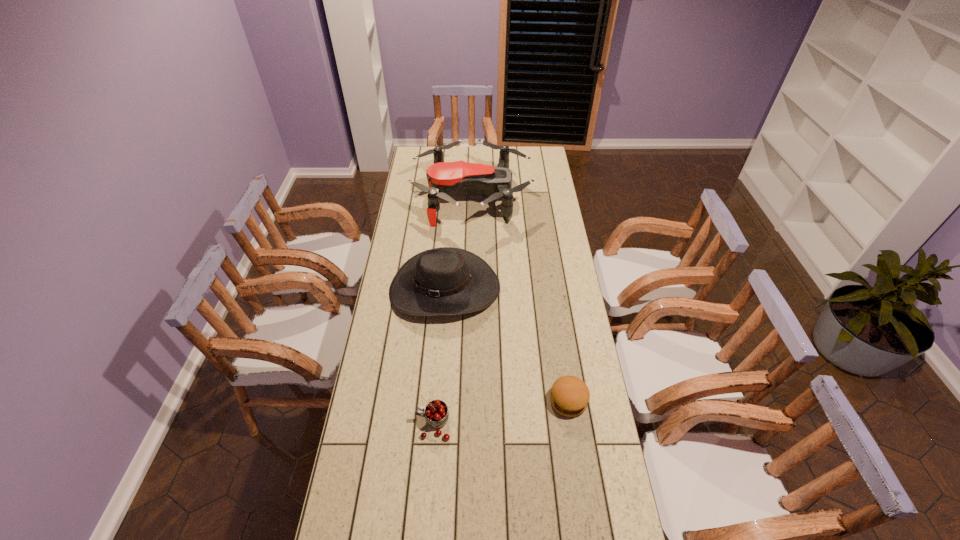
I want to click on object located in the far edge section of the desktop, so click(x=445, y=180).

You are a GUI agent. You are given a task and a screenshot of the screen. Output one action in this format:
    pyautogui.click(x=<x>, y=<y>)
    Task: Click on the drone positioned at the left edge
    The width and height of the screenshot is (960, 540).
    Given the screenshot: What is the action you would take?
    tap(445, 180)

This screenshot has width=960, height=540. What are the coordinates of `cowboy hat that is at the left edge` in the screenshot? It's located at (445, 281).

Identify the location of drone present at the right edge. Image resolution: width=960 pixels, height=540 pixels. (445, 180).

Identify the location of hamburger that is at the right edge. This screenshot has height=540, width=960. pos(569,396).

Find the location of a particular element. object present at the far left corner is located at coordinates (445, 180).

Locate an element on the screen. The height and width of the screenshot is (540, 960). object that is at the far right corner is located at coordinates (445, 180).

The image size is (960, 540). I want to click on free space at the far edge of the desktop, so click(457, 153).

Where is `vacant space at the left edge of the desktop`? This screenshot has width=960, height=540. vacant space at the left edge of the desktop is located at coordinates pyautogui.click(x=405, y=190).

Where is `blank space at the right edge`? blank space at the right edge is located at coordinates (587, 356).